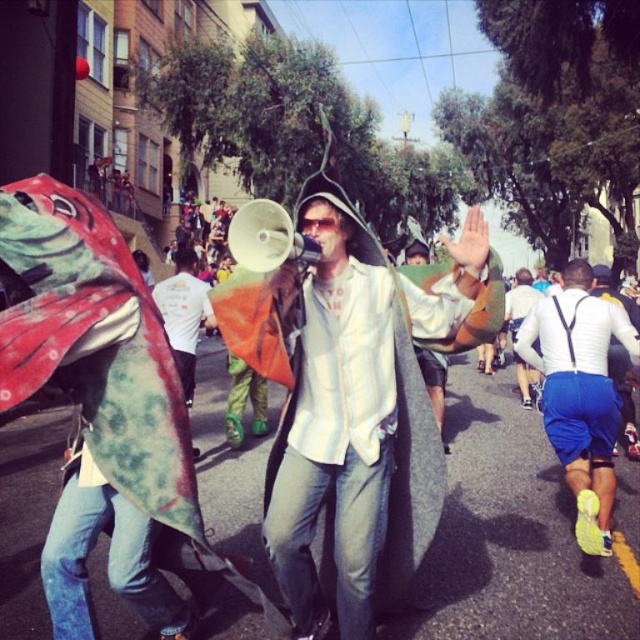
You are a photographer standing at the center of the street. You want to take a photo that includes both the white striped shirt at center and the large fish head prop. Which object should you adjust your camera angle to focus on first to ensure both are in frame?

The white striped shirt at center is located at point [358,417], so you should focus on the white striped shirt at center first to ensure both it and the large fish head prop are in frame.

You are standing on the street and want to take a photo of both the fish head costume and the person on the balcony. The fish head costume is at point (371, 330) and the balcony person is at point (563, 387). Which point is closer to you?

Point (371, 330) is closer to the viewer than point (563, 387).

You are a photographer trying to capture the entire scene in one shot. You notice the white striped shirt at center and the white matte shorts at lower right. Which of these two items might require you to adjust your camera angle to ensure they are fully in frame?

The white striped shirt at center might require adjusting the camera angle because it is wider than the white matte shorts at lower right, so it could be closer to the edge of the frame and need repositioning to include the entire object.